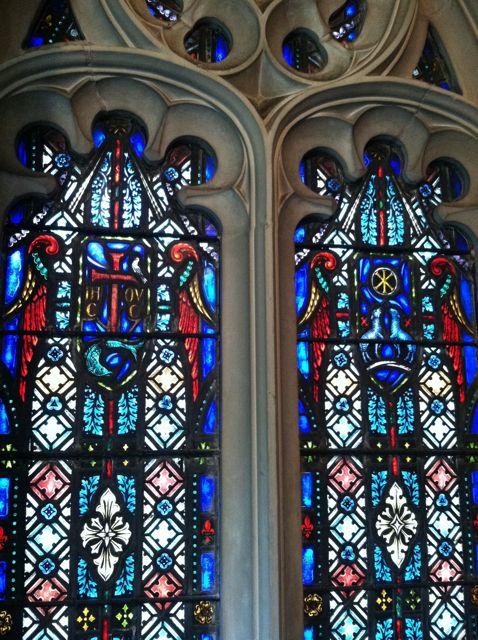
The image size is (478, 640). I want to click on window, so click(x=112, y=431), click(x=362, y=429), click(x=214, y=42), click(x=424, y=58), click(x=50, y=22), click(x=303, y=50), click(x=349, y=22), click(x=158, y=6).